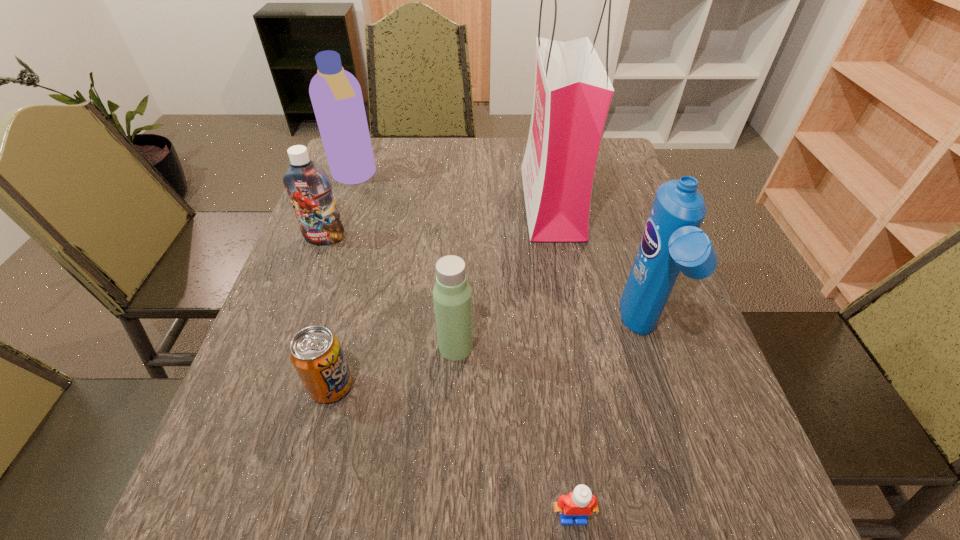
Identify which shampoo is the second nearest to the rightmost shampoo. Please provide its 2D coordinates. Your answer should be formatted as a tuple, i.e. [(x, y)], where the tuple contains the x and y coordinates of a point satisfying the conditions above.

[(336, 96)]

The width and height of the screenshot is (960, 540). I want to click on vacant space that satisfies the following two spatial constraints: 1. on the front label of the shortest shampoo; 2. on the left side of the second shortest object, so click(x=271, y=386).

This screenshot has width=960, height=540. I want to click on free space that satisfies the following two spatial constraints: 1. on the front label of the shortest shampoo; 2. on the left side of the rightmost object, so click(x=290, y=332).

Identify the location of vacant area that satisfies the following two spatial constraints: 1. on the front-facing side of the tallest object; 2. on the back side of the nearest shampoo. tap(576, 332).

The width and height of the screenshot is (960, 540). Identify the location of vacant point that satisfies the following two spatial constraints: 1. on the front side of the farthest shampoo; 2. on the left side of the thermos bottle. (295, 347).

You are a GUI agent. You are given a task and a screenshot of the screen. Output one action in this format:
    pyautogui.click(x=<x>, y=<y>)
    Task: Click on the free location that satisfies the following two spatial constraints: 1. on the front label of the soda can; 2. on the left side of the shortest shampoo
    
    Given the screenshot: What is the action you would take?
    pyautogui.click(x=271, y=386)